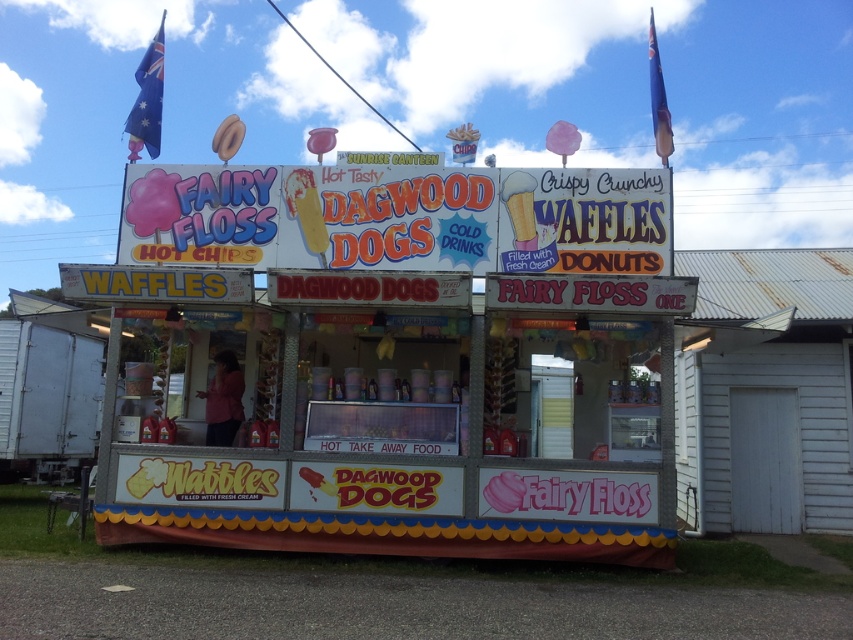
Question: Which point is closer to the camera?

Choices:
 (A) pink cotton candy at center
 (B) matte plastic cotton candy at upper center
 (C) metallic silver trailer at lower left

Answer: (A)

Question: Can you confirm if matte plastic ticket booth at center is thinner than matte plastic cotton candy at upper center?

Choices:
 (A) yes
 (B) no

Answer: (B)

Question: Which point appears closest to the camera in this image?

Choices:
 (A) (221, 429)
 (B) (447, 232)

Answer: (B)

Question: Does metallic silver trailer at lower left have a larger size compared to pink fabric vendor at center?

Choices:
 (A) no
 (B) yes

Answer: (B)

Question: Which point appears closest to the camera in this image?

Choices:
 (A) (241, 134)
 (B) (352, 256)

Answer: (B)

Question: Can you confirm if metallic silver trailer at lower left is smaller than pink cotton candy at center?

Choices:
 (A) no
 (B) yes

Answer: (A)